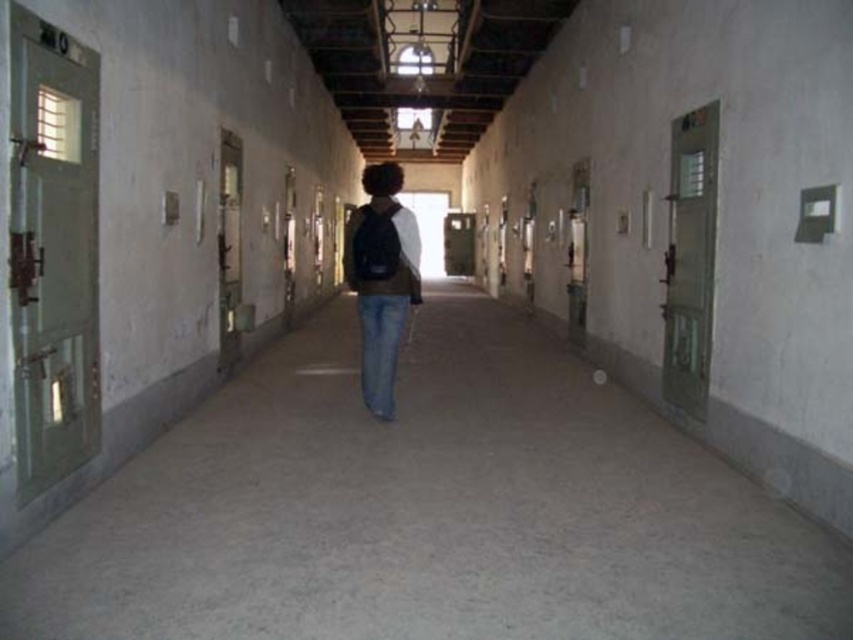
You are standing at the entrance of the corridor and want to reach the point marked at coordinates (372, 376). Given that the corridor is 20 feet long, can you walk straight to that point without needing to turn?

The point marked at coordinates (372, 376) is 19.30 feet away from your current position. Since the corridor is 20 feet long, you can walk straight to that point without needing to turn as it is within the corridor length.

Based on the photo, you are standing in the corridor and notice two points marked on the wall. The first point is at coordinates point (368, 268) and the second is at point (378, 412). Which point is closer to you?

Point (368, 268) is closer to the viewer than point (378, 412).